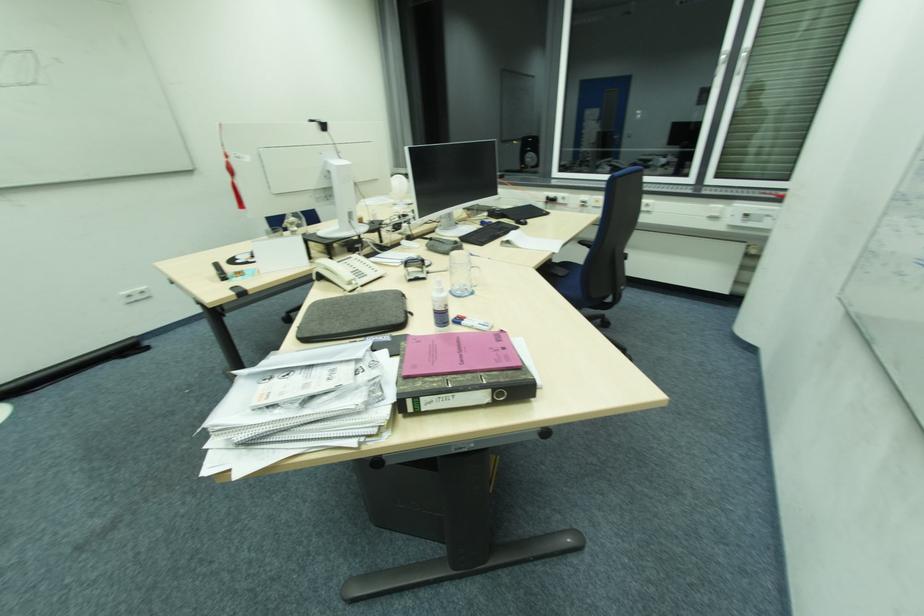
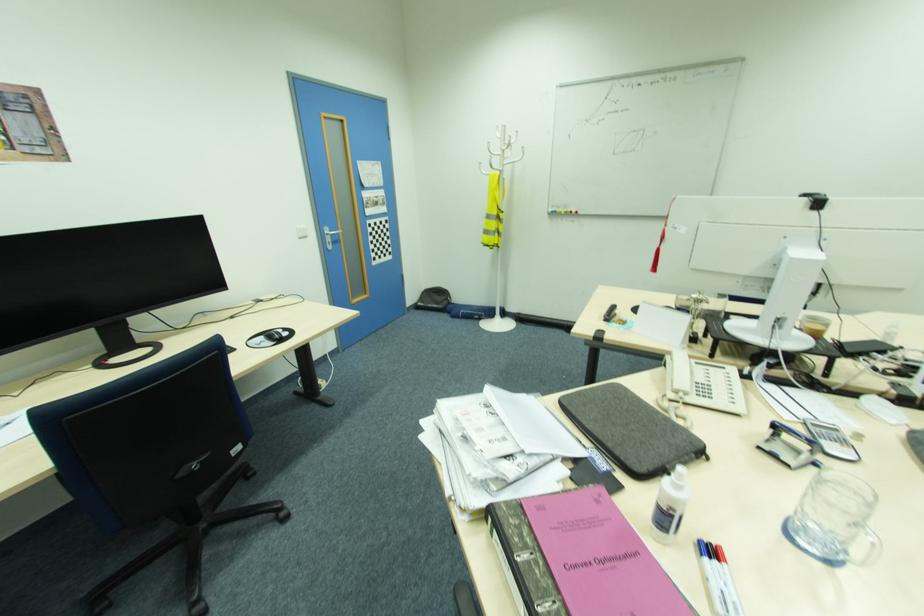
Based on the continuous images, in which direction is the camera rotating?

The camera's rotation is toward left-down.